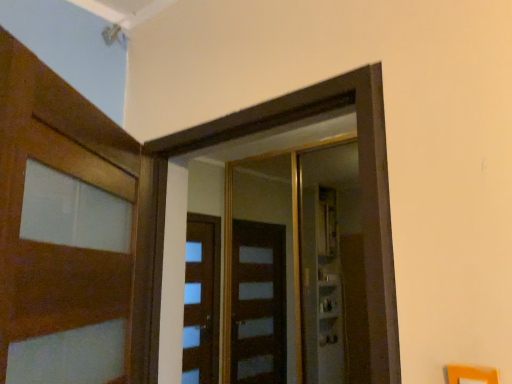
Question: From the image's perspective, would you say transparent glass elevator at center, the 2th elevator from the front, is shown under wooden door at left?

Choices:
 (A) no
 (B) yes

Answer: (B)

Question: Is transparent glass elevator at center, the 1th elevator when ordered from back to front, surrounding wooden door at left?

Choices:
 (A) yes
 (B) no

Answer: (B)

Question: Could you tell me if transparent glass elevator at center, the 2th elevator from the front, is facing wooden door at left?

Choices:
 (A) yes
 (B) no

Answer: (A)

Question: Does transparent glass elevator at center, the 2th elevator from the front, have a lesser width compared to wooden door at left?

Choices:
 (A) no
 (B) yes

Answer: (B)

Question: Does transparent glass elevator at center, the 1th elevator when ordered from back to front, have a lesser height compared to wooden door at left?

Choices:
 (A) no
 (B) yes

Answer: (A)

Question: Relative to wooden door at left, is wooden door at center, the second elevator viewed from the back, in front or behind?

Choices:
 (A) behind
 (B) front

Answer: (A)

Question: Considering the positions of wooden door at center, the second elevator viewed from the back, and wooden door at left in the image, is wooden door at center, the second elevator viewed from the back, bigger or smaller than wooden door at left?

Choices:
 (A) big
 (B) small

Answer: (B)

Question: Is point (348, 89) closer or farther from the camera than point (7, 243)?

Choices:
 (A) closer
 (B) farther

Answer: (B)

Question: Visually, is wooden door at center, the second elevator viewed from the back, positioned to the left or to the right of wooden door at left?

Choices:
 (A) left
 (B) right

Answer: (B)

Question: Does point (16, 251) appear closer or farther from the camera than point (371, 241)?

Choices:
 (A) farther
 (B) closer

Answer: (B)

Question: From a real-world perspective, is wooden door at left above or below wooden door at center, placed as the 1th elevator when sorted from front to back?

Choices:
 (A) below
 (B) above

Answer: (A)

Question: Considering the positions of wooden door at left and wooden door at center, the second elevator viewed from the back, in the image, is wooden door at left wider or thinner than wooden door at center, the second elevator viewed from the back,?

Choices:
 (A) thin
 (B) wide

Answer: (B)

Question: In the image, is wooden door at left on the left side or the right side of wooden door at center, placed as the 1th elevator when sorted from front to back?

Choices:
 (A) right
 (B) left

Answer: (B)

Question: Is transparent glass elevator at center, the 1th elevator when ordered from back to front, wider or thinner than wooden door at center, placed as the 1th elevator when sorted from front to back?

Choices:
 (A) thin
 (B) wide

Answer: (A)

Question: Is transparent glass elevator at center, the 2th elevator from the front, spatially inside wooden door at center, placed as the 1th elevator when sorted from front to back, or outside of it?

Choices:
 (A) outside
 (B) inside

Answer: (A)